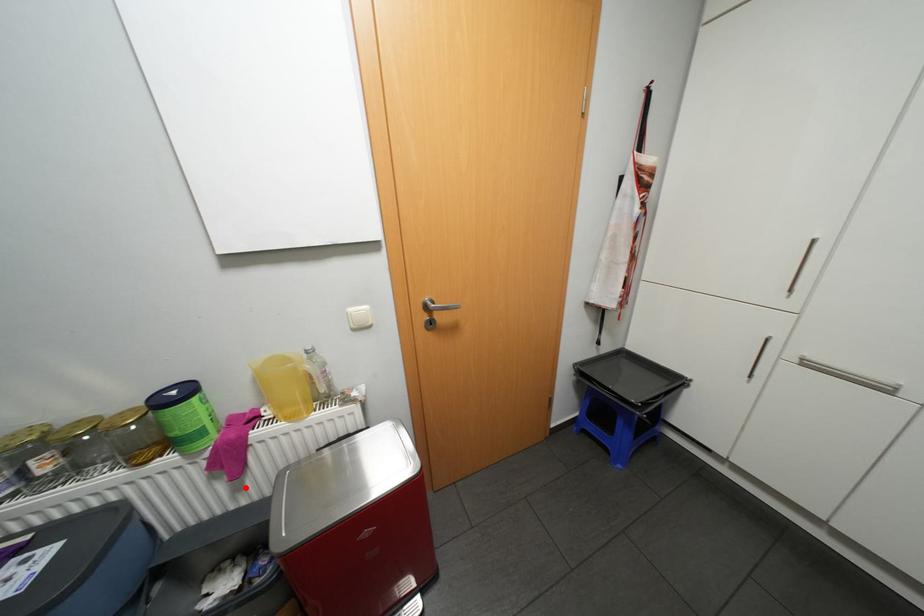
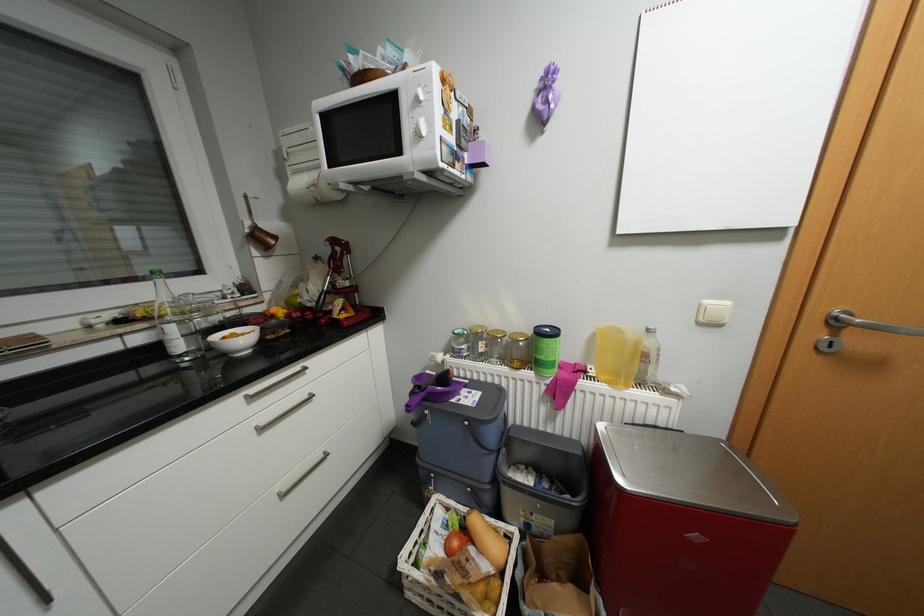
In the second image, find the point that corresponds to the highlighted location in the first image.

(558, 416)